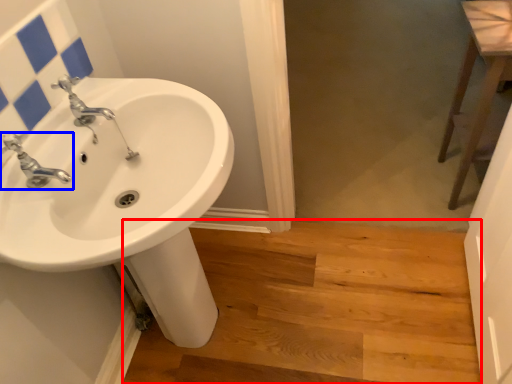
Question: Which point is closer to the camera, stairwell (highlighted by a red box) or tap (highlighted by a blue box)?

Choices:
 (A) stairwell
 (B) tap

Answer: (B)